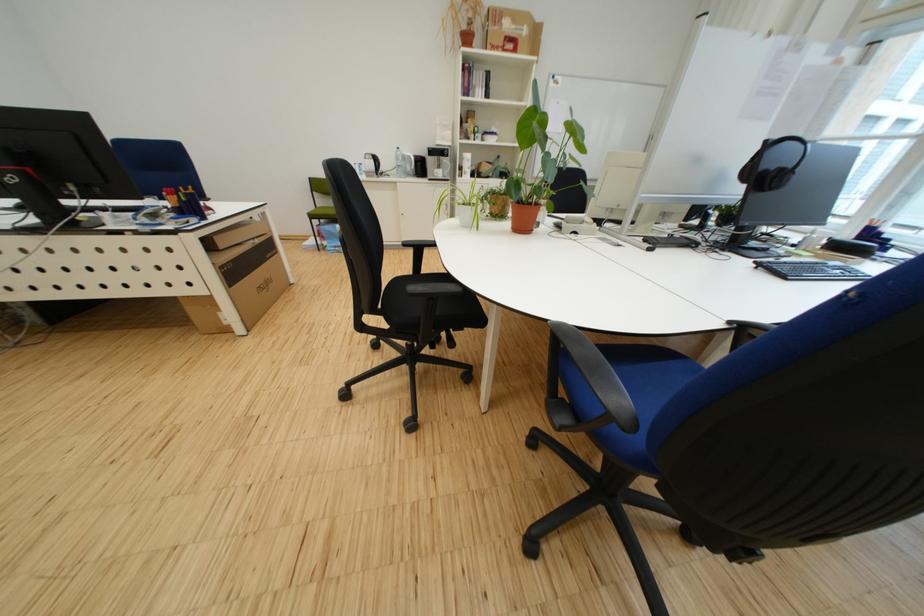
What do you see at coordinates (810, 270) in the screenshot? This screenshot has height=616, width=924. I see `the black keyboard` at bounding box center [810, 270].